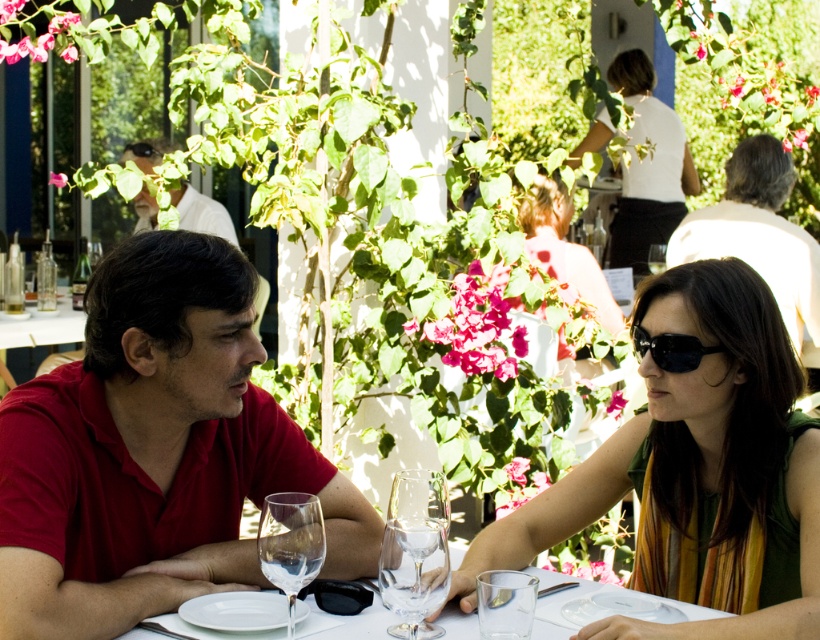
Is matte green dress at center taller than white cotton shirt at upper center?

No, matte green dress at center is not taller than white cotton shirt at upper center.

Between matte green dress at center and white cotton shirt at upper center, which one appears on the right side from the viewer's perspective?

From the viewer's perspective, white cotton shirt at upper center appears more on the right side.

This screenshot has height=640, width=820. What are the coordinates of `matte green dress at center` in the screenshot? It's located at (697, 472).

Can you confirm if white glassware at center is wider than white shirt at upper left?

Yes.

Who is positioned more to the right, white glassware at center or white shirt at upper left?

Positioned to the right is white glassware at center.

Find the location of a particular element. This screenshot has height=640, width=820. white glassware at center is located at coordinates (354, 625).

Is transparent glass wine glass at lower center thinner than black plastic goggles at center?

Indeed, transparent glass wine glass at lower center has a lesser width compared to black plastic goggles at center.

Looking at this image, is transparent glass wine glass at lower center below black plastic goggles at center?

Actually, transparent glass wine glass at lower center is above black plastic goggles at center.

Is point (290, 497) positioned in front of point (362, 588)?

Yes, it is.

The width and height of the screenshot is (820, 640). Identify the location of transparent glass wine glass at lower center. (290, 544).